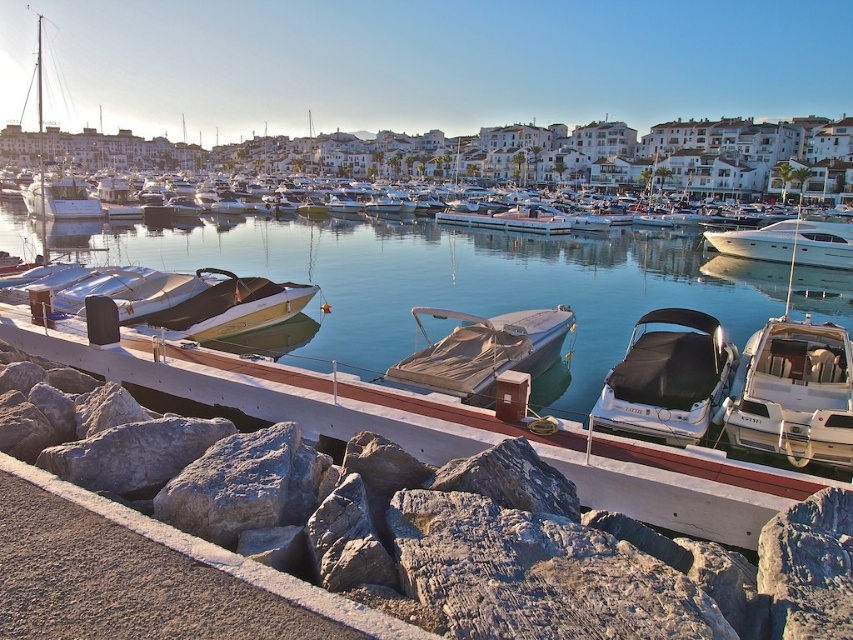
Question: Is black tarpaulin boat at center positioned at the back of white glossy speedboat at center?

Choices:
 (A) no
 (B) yes

Answer: (A)

Question: Is white concrete dock at center below beige canvas boat at center?

Choices:
 (A) no
 (B) yes

Answer: (A)

Question: Considering the real-world distances, which object is closest to the clear blue water at center?

Choices:
 (A) white glossy yacht at right
 (B) black tarpaulin boat at center
 (C) beige canvas boat at center
 (D) white concrete dock at center

Answer: (C)

Question: Estimate the real-world distances between objects in this image. Which object is closer to the white glossy yacht at right?

Choices:
 (A) beige canvas boat at center
 (B) white glossy speedboat at center
 (C) white concrete dock at center

Answer: (B)

Question: Which point is closer to the camera?

Choices:
 (A) (688, 340)
 (B) (549, 256)
 (C) (227, 276)

Answer: (A)

Question: Can you confirm if black tarpaulin boat at center is positioned above beige canvas boat at center?

Choices:
 (A) yes
 (B) no

Answer: (B)